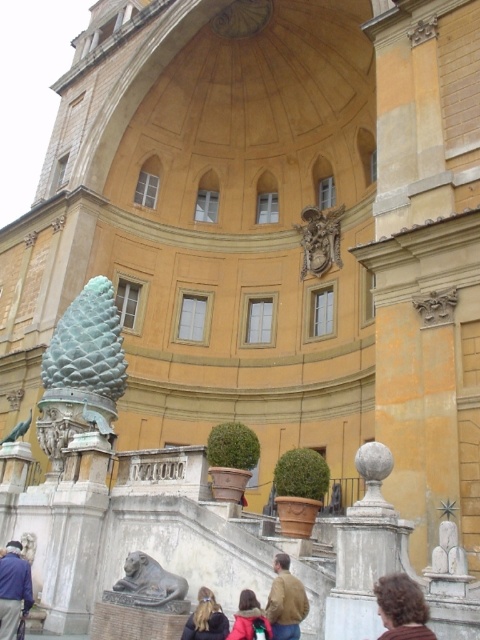
You are an art student visiting the historical building and notice the bronze statue at lower center and the brown leather jacket at center. Which object is closer to you as you stand in front of the building?

The bronze statue at lower center is closer to you because the brown leather jacket at center is behind it.

You are an art student visiting the building and notice the bronze statue at lower center and the brown leather jacket at center. Which object is shorter?

The bronze statue at lower center is shorter than the brown leather jacket at center.

From the picture: You are standing in front of the grand historical building and notice the bronze statue at lower center and the brown leather jacket at center. Which object is positioned lower in the scene?

The bronze statue at lower center is positioned lower than the brown leather jacket at center.